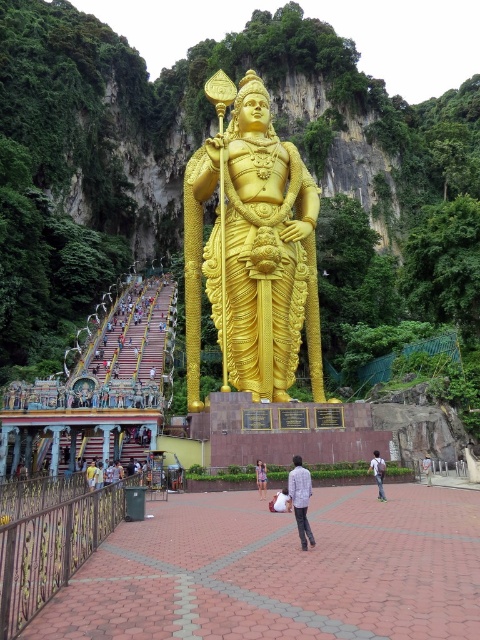
Which of these two, light gray fabric shirt at center or white cotton shirt at center, stands shorter?

Standing shorter between the two is light gray fabric shirt at center.

Is point (299, 460) closer to camera compared to point (139, 468)?

That is True.

The width and height of the screenshot is (480, 640). I want to click on light gray fabric shirt at center, so click(300, 499).

Is white cotton shirt at center positioned at the back of light blue denim jeans at center?

No, white cotton shirt at center is in front of light blue denim jeans at center.

Which of these two, white cotton shirt at center or light blue denim jeans at center, stands taller?

white cotton shirt at center is taller.

Which is behind, point (109, 477) or point (372, 472)?

Point (109, 477)

The width and height of the screenshot is (480, 640). What are the coordinates of `white cotton shirt at center` in the screenshot? It's located at (113, 474).

Who is shorter, light blue denim jeans at center or denim shorts at center?

Standing shorter between the two is denim shorts at center.

Which is below, light blue denim jeans at center or denim shorts at center?

denim shorts at center is below.

Which is behind, point (375, 468) or point (264, 481)?

Point (264, 481)

What are the coordinates of `light blue denim jeans at center` in the screenshot? It's located at (379, 472).